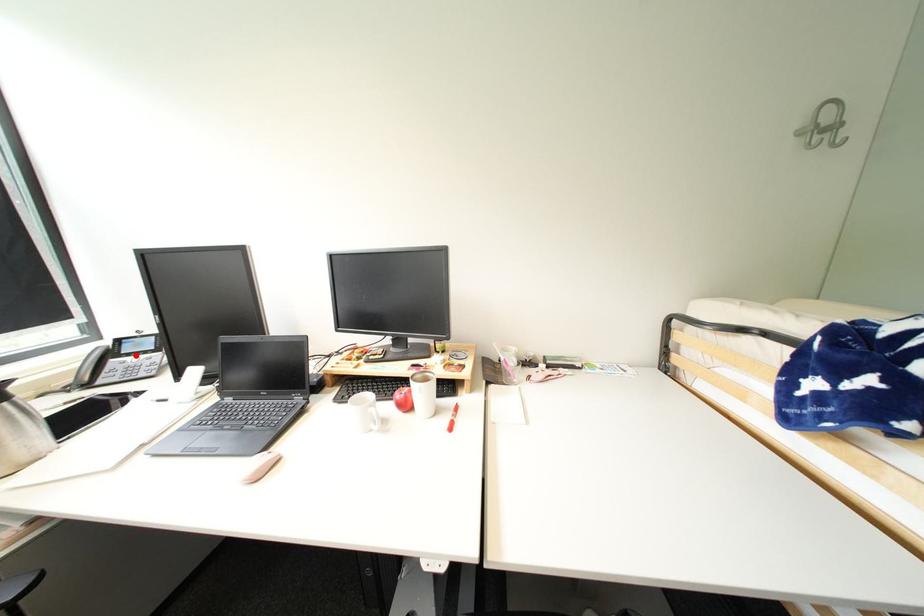
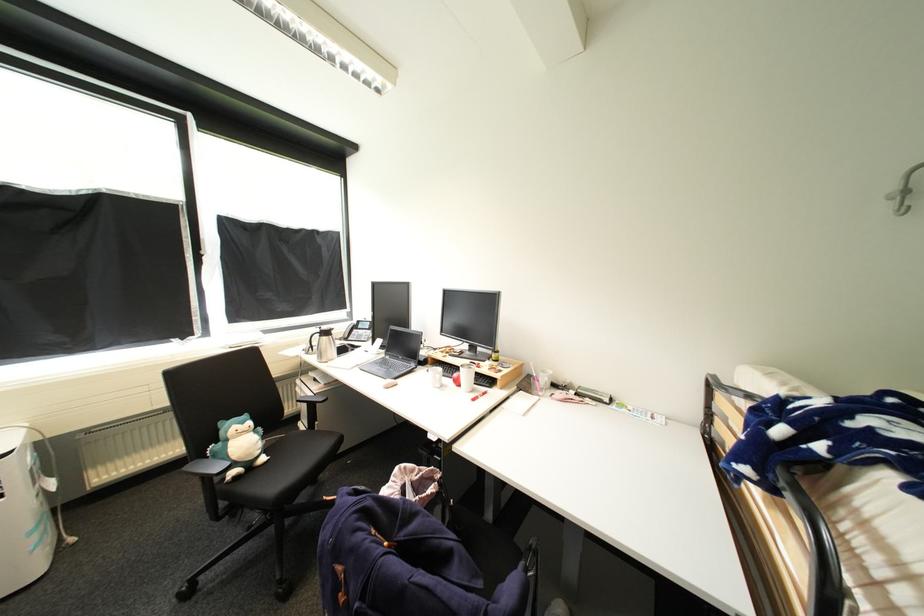
Question: A red point is marked in image1. In image2, is the corresponding 3D point closer to the camera or farther? Reply with the corresponding letter.

Choices:
 (A) The corresponding 3D point is closer.
 (B) The corresponding 3D point is farther.

Answer: (B)